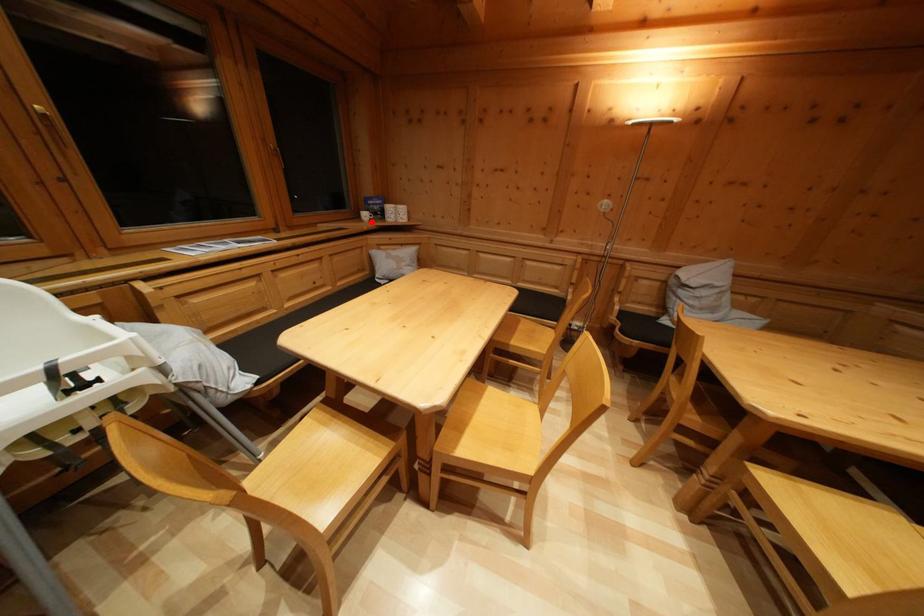
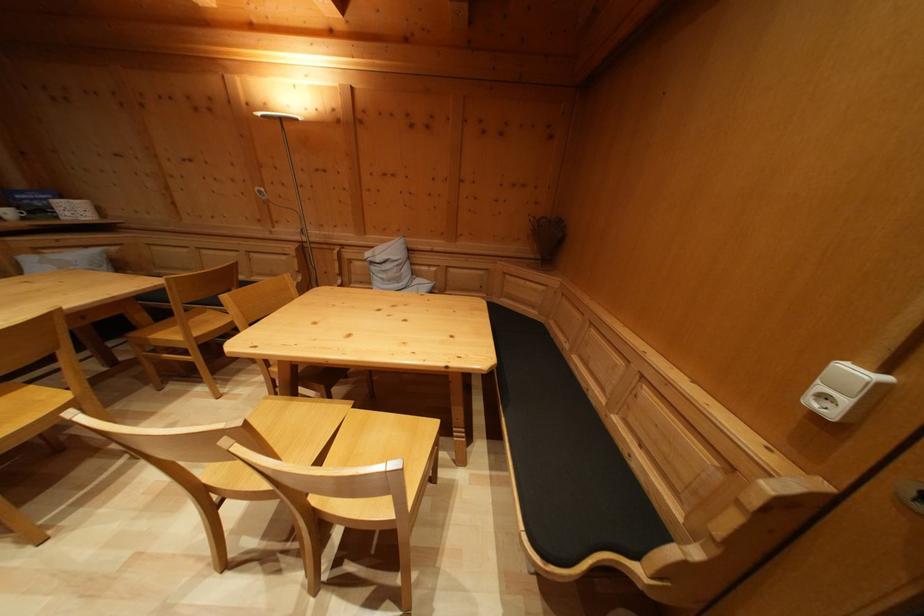
Find the pixel in the second image that matches the highlighted location in the first image.

(14, 219)